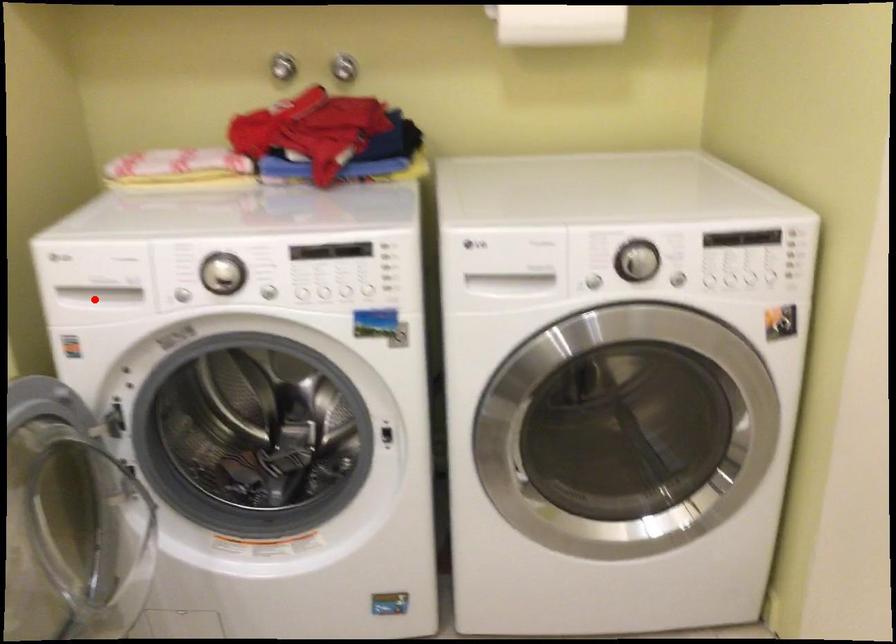
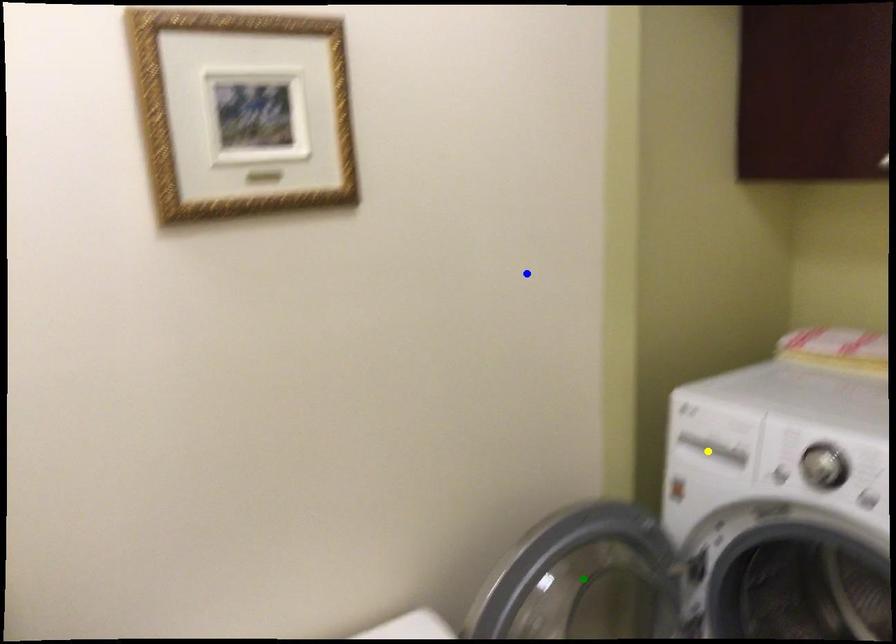
Question: I am providing you with two images of the same scene from different viewpoints. A red point is marked on the first image. You are given multiple points on the second image. In image 2, which mark is for the same physical point as the one in image 1?

Choices:
 (A) green point
 (B) blue point
 (C) yellow point

Answer: (C)